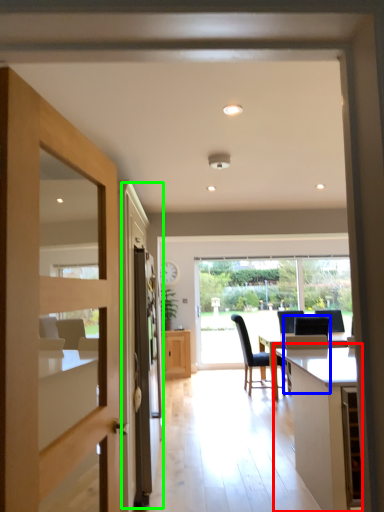
Question: Which object is the closest to the table (highlighted by a red box)? Choose among these: chair (highlighted by a blue box) or screen door (highlighted by a green box).

Choices:
 (A) chair
 (B) screen door

Answer: (A)